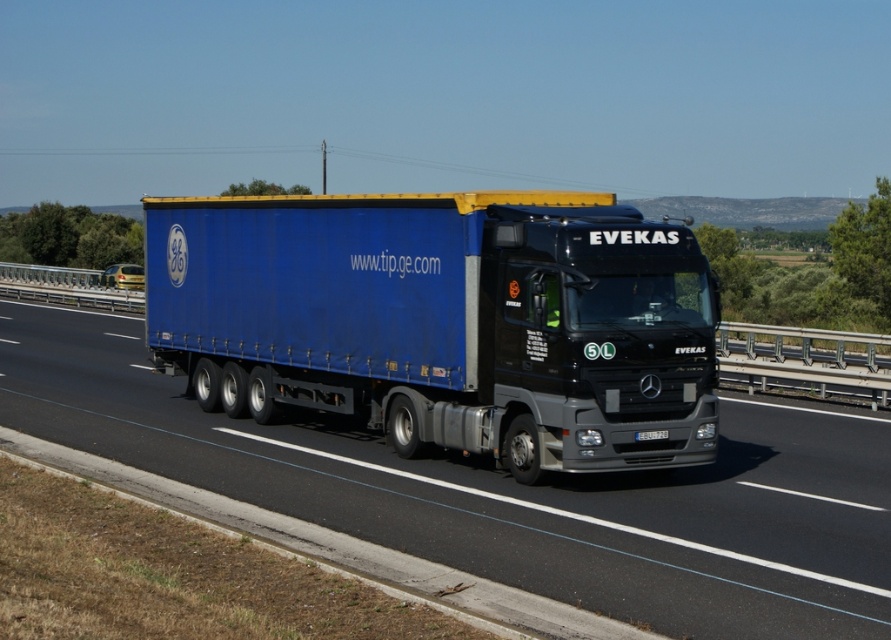
You are a delivery driver who needs to park your truck in a space that can only accommodate vehicles up to the size of the blue fabric truck at center. Can the blue matte trailer truck at center fit in this parking spot?

The blue matte trailer truck at center is larger than the blue fabric truck at center, so it cannot fit in the parking spot designed for the smaller vehicle.